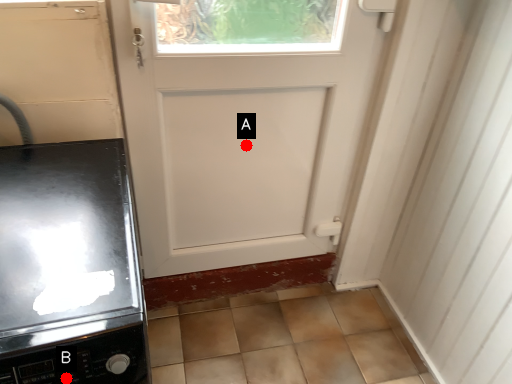
Question: Two points are circled on the image, labeled by A and B beside each circle. Which point is farther to the camera?

Choices:
 (A) A is further
 (B) B is further

Answer: (A)